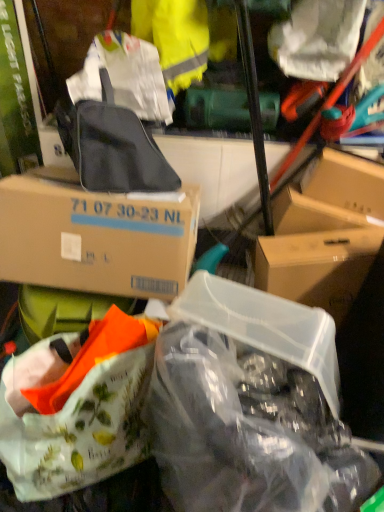
The image size is (384, 512). What do you see at coordinates (96, 236) in the screenshot?
I see `brown cardboard box at upper left, the first box from the left` at bounding box center [96, 236].

I want to click on transparent plastic bag at center, which is the 1th plastic bag in bottom-to-top order, so click(248, 431).

Where is `white fabric handbag at lower left`? white fabric handbag at lower left is located at coordinates (77, 407).

Is white fabric handbag at lower left wider than matte black backpack at upper center?

Indeed, white fabric handbag at lower left has a greater width compared to matte black backpack at upper center.

Which of these two, white fabric handbag at lower left or matte black backpack at upper center, is smaller?

Answer: Smaller between the two is matte black backpack at upper center.

From a real-world perspective, which object stands above the other?

In real-world perspective, matte black backpack at upper center is above.

Would you say yellow fabric at upper center contains brown cardboard box at upper left, marked as the 2th box in a right-to-left arrangement?

Definitely not — brown cardboard box at upper left, marked as the 2th box in a right-to-left arrangement, is not inside yellow fabric at upper center.

Is yellow fabric at upper center far from brown cardboard box at upper left, the first box from the left?

yellow fabric at upper center is near brown cardboard box at upper left, the first box from the left, not far away.

Is yellow fabric at upper center taller than brown cardboard box at upper left, marked as the 2th box in a right-to-left arrangement?

Yes.

How different are the orientations of yellow fabric at upper center and brown cardboard box at upper left, marked as the 2th box in a right-to-left arrangement, in degrees?

They differ by 0.796 degrees in their facing directions.

Measure the distance between matte black backpack at upper center and transparent plastic bag at center, which appears as the 2th plastic bag when viewed from the top.

They are 71.56 centimeters apart.

Is matte black backpack at upper center looking in the opposite direction of transparent plastic bag at center, which appears as the 2th plastic bag when viewed from the top?

No, matte black backpack at upper center is not facing the opposite direction of transparent plastic bag at center, which appears as the 2th plastic bag when viewed from the top.

Which object is more forward, matte black backpack at upper center or transparent plastic bag at center, which appears as the 2th plastic bag when viewed from the top?

transparent plastic bag at center, which appears as the 2th plastic bag when viewed from the top, is closer to the camera.

Is brown cardboard box at upper left, the first box from the left, further to camera compared to transparent plastic container at center-right, which is the 1th box in right-to-left order?

No, the depth of brown cardboard box at upper left, the first box from the left, is less than that of transparent plastic container at center-right, which is the 1th box in right-to-left order.

Does brown cardboard box at upper left, the first box from the left, appear on the left side of transparent plastic container at center-right, the second box when ordered from left to right?

Yes.

Does point (82, 281) appear closer or farther from the camera than point (298, 241)?

Point (82, 281) appears to be closer to the viewer than point (298, 241).

Which of these two, brown cardboard box at upper left, marked as the 2th box in a right-to-left arrangement, or transparent plastic container at center-right, which is the 1th box in right-to-left order, is smaller?

With smaller size is transparent plastic container at center-right, which is the 1th box in right-to-left order.

Is the surface of transparent plastic bag at center, which is the 1th plastic bag in bottom-to-top order, in direct contact with white fabric handbag at lower left?

No, transparent plastic bag at center, which is the 1th plastic bag in bottom-to-top order, is not next to white fabric handbag at lower left.

In the image, is transparent plastic bag at center, which appears as the 2th plastic bag when viewed from the top, positioned in front of or behind white fabric handbag at lower left?

transparent plastic bag at center, which appears as the 2th plastic bag when viewed from the top, is positioned closer to the viewer than white fabric handbag at lower left.

How many degrees apart are the facing directions of transparent plastic bag at center, which appears as the 2th plastic bag when viewed from the top, and white fabric handbag at lower left?

The facing directions of transparent plastic bag at center, which appears as the 2th plastic bag when viewed from the top, and white fabric handbag at lower left are 29.9 degrees apart.

Is transparent plastic container at center-right, the second box when ordered from left to right, aimed at white fabric handbag at lower left?

No, transparent plastic container at center-right, the second box when ordered from left to right, is not oriented towards white fabric handbag at lower left.

How distant is transparent plastic container at center-right, the second box when ordered from left to right, from white fabric handbag at lower left?

transparent plastic container at center-right, the second box when ordered from left to right, and white fabric handbag at lower left are 26.21 inches apart from each other.

Relative to white fabric handbag at lower left, is transparent plastic container at center-right, which is the 1th box in right-to-left order, in front or behind?

Clearly, transparent plastic container at center-right, which is the 1th box in right-to-left order, is behind white fabric handbag at lower left.

Considering the relative sizes of brown cardboard box at upper left, the first box from the left, and yellow fabric at upper center in the image provided, is brown cardboard box at upper left, the first box from the left, thinner than yellow fabric at upper center?

Incorrect, the width of brown cardboard box at upper left, the first box from the left, is not less than that of yellow fabric at upper center.

Between brown cardboard box at upper left, the first box from the left, and yellow fabric at upper center, which one has larger size?

brown cardboard box at upper left, the first box from the left.

The width and height of the screenshot is (384, 512). What are the coordinates of `backpack lying above the white fabric handbag at lower left (from the image's perspective)` in the screenshot? It's located at (112, 146).

There is a yellow fabric at upper center. Where is `the 1st box below it (from the image's perspective)`? This screenshot has height=512, width=384. the 1st box below it (from the image's perspective) is located at coordinates (96, 236).

From the image, which object appears to be nearer to brown cardboard box at upper left, marked as the 2th box in a right-to-left arrangement, white matte plastic bag at upper right, which is the second plastic bag in bottom-to-top order, or yellow fabric at upper center?

yellow fabric at upper center.

Based on their spatial positions, is transparent plastic bag at center, which is the 1th plastic bag in bottom-to-top order, or white matte plastic bag at upper right, positioned as the first plastic bag in top-to-bottom order, further from brown cardboard box at upper left, the first box from the left?

The object further to brown cardboard box at upper left, the first box from the left, is white matte plastic bag at upper right, positioned as the first plastic bag in top-to-bottom order.

From the image, which object appears to be farther from matte black backpack at upper center, white matte plastic bag at upper right, positioned as the first plastic bag in top-to-bottom order, or yellow fabric at upper center?

white matte plastic bag at upper right, positioned as the first plastic bag in top-to-bottom order, is further to matte black backpack at upper center.

Considering their positions, is white matte plastic bag at upper right, which is the second plastic bag in bottom-to-top order, positioned further to matte black backpack at upper center than brown cardboard box at upper left, marked as the 2th box in a right-to-left arrangement?

white matte plastic bag at upper right, which is the second plastic bag in bottom-to-top order, is further to matte black backpack at upper center.

Considering their positions, is brown cardboard box at upper left, marked as the 2th box in a right-to-left arrangement, positioned further to transparent plastic container at center-right, the second box when ordered from left to right, than yellow fabric at upper center?

yellow fabric at upper center.

Which object lies nearer to the anchor point white matte plastic bag at upper right, positioned as the first plastic bag in top-to-bottom order, brown cardboard box at upper left, marked as the 2th box in a right-to-left arrangement, or transparent plastic container at center-right, which is the 1th box in right-to-left order?

Among the two, transparent plastic container at center-right, which is the 1th box in right-to-left order, is located nearer to white matte plastic bag at upper right, positioned as the first plastic bag in top-to-bottom order.

Looking at the image, which one is located closer to matte black backpack at upper center, yellow fabric at upper center or transparent plastic bag at center, which appears as the 2th plastic bag when viewed from the top?

yellow fabric at upper center is positioned closer to the anchor matte black backpack at upper center.

Based on their spatial positions, is transparent plastic container at center-right, which is the 1th box in right-to-left order, or transparent plastic bag at center, which appears as the 2th plastic bag when viewed from the top, closer to yellow fabric at upper center?

Among the two, transparent plastic container at center-right, which is the 1th box in right-to-left order, is located nearer to yellow fabric at upper center.

I want to click on plastic bag between white fabric handbag at lower left and transparent plastic container at center-right, the second box when ordered from left to right, from left to right, so click(x=248, y=431).

Identify the location of backpack situated between brown cardboard box at upper left, the first box from the left, and white matte plastic bag at upper right, positioned as the first plastic bag in top-to-bottom order, from left to right. (112, 146).

This screenshot has height=512, width=384. In order to click on handbag between matte black backpack at upper center and transparent plastic bag at center, which is the 1th plastic bag in bottom-to-top order, vertically in this screenshot , I will do `click(77, 407)`.

The width and height of the screenshot is (384, 512). What are the coordinates of `backpack that lies between white matte plastic bag at upper right, positioned as the first plastic bag in top-to-bottom order, and transparent plastic container at center-right, which is the 1th box in right-to-left order, from top to bottom` in the screenshot? It's located at (112, 146).